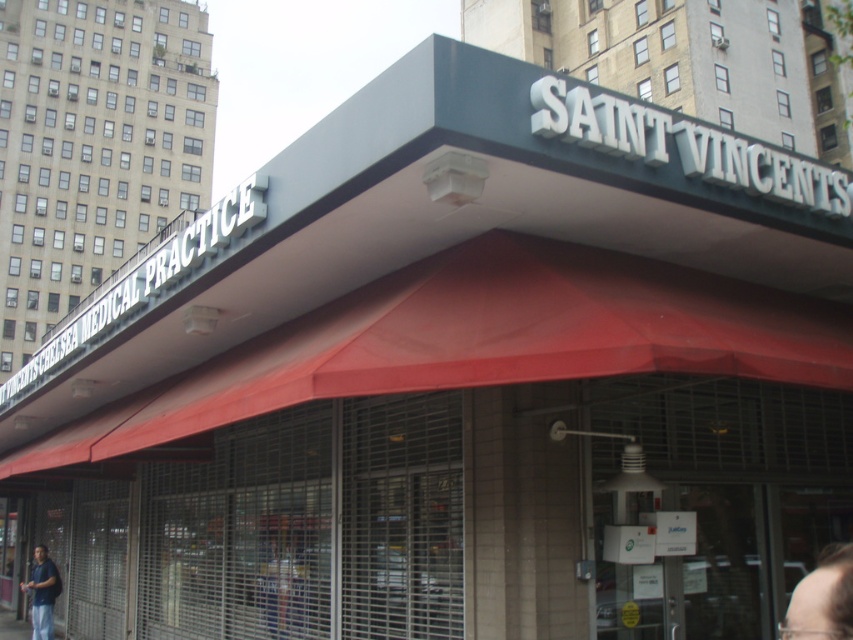
Which is behind, point (793, 596) or point (50, 604)?

The point (50, 604) is behind.

Is point (839, 595) more distant than point (54, 577)?

No, it is in front of (54, 577).

Identify the location of dark brown hair at lower right. This screenshot has width=853, height=640. (822, 598).